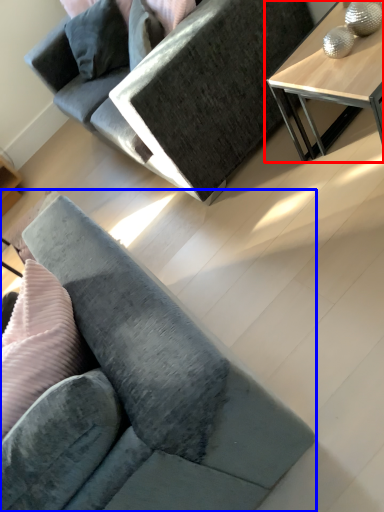
Question: Which object appears farthest to the camera in this image, table (highlighted by a red box) or studio couch (highlighted by a blue box)?

Choices:
 (A) table
 (B) studio couch

Answer: (A)